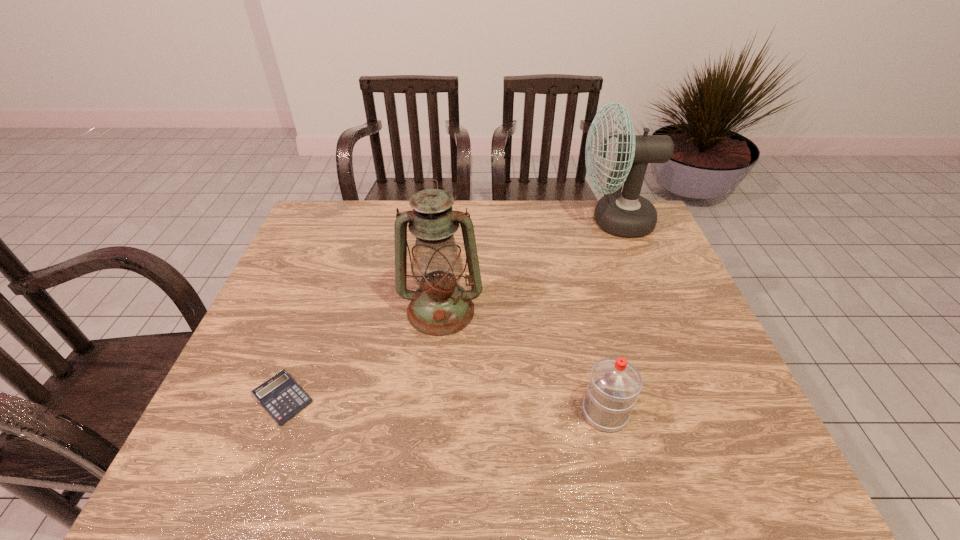
Image resolution: width=960 pixels, height=540 pixels. Find the location of `vacant area situated in front of the fan where the airflow is directed`. vacant area situated in front of the fan where the airflow is directed is located at coordinates (522, 221).

Locate an element on the screen. free space located 0.310m on the right of the oil lamp is located at coordinates (597, 310).

I want to click on vacant point located on the handle side of the water bottle, so click(586, 329).

The height and width of the screenshot is (540, 960). What are the coordinates of `vacant area situated on the handle side of the water bottle` in the screenshot? It's located at (593, 363).

Identify the location of vacant region located 0.230m on the handle side of the water bottle. This screenshot has width=960, height=540. (583, 318).

Locate an element on the screen. This screenshot has width=960, height=540. free space located 0.350m on the right of the shortest object is located at coordinates (469, 399).

At what (x,y) coordinates should I click in order to perform the action: click on object that is at the far edge. Please return your answer as a coordinate pair (x, y). Image resolution: width=960 pixels, height=540 pixels. Looking at the image, I should click on (627, 214).

Find the location of a particular element. This screenshot has width=960, height=540. object situated at the left edge is located at coordinates (281, 396).

Locate an element on the screen. object at the right edge is located at coordinates (627, 214).

Locate an element on the screen. The height and width of the screenshot is (540, 960). object that is at the far right corner is located at coordinates (627, 214).